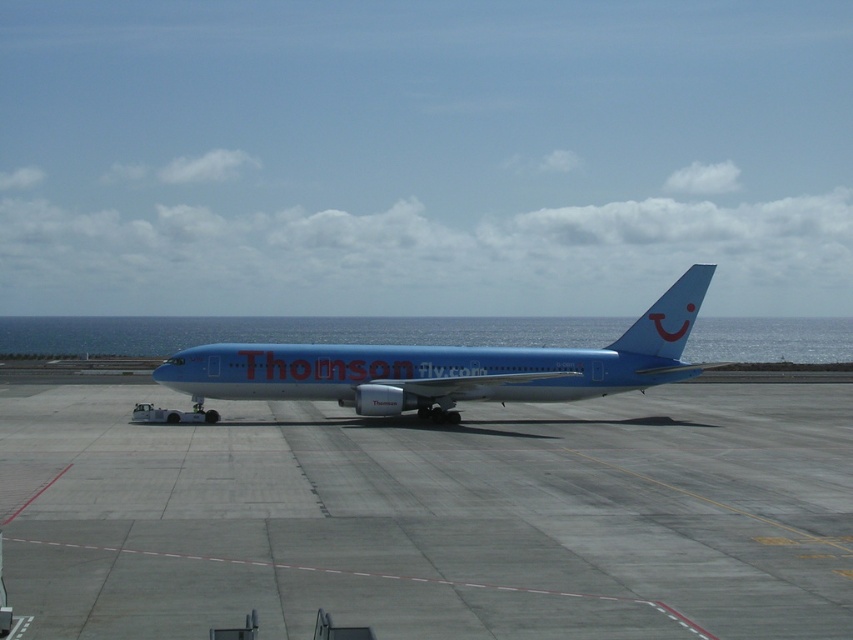
You are a ground crew member who needs to inspect the blue glossy airplane at center. Since the smooth concrete tarmac at center is under it, can you walk underneath the airplane to check the landing gear?

The smooth concrete tarmac at center is positioned under the blue glossy airplane at center, so yes, you can walk underneath the blue glossy airplane at center to check the landing gear since the tarmac provides a solid surface beneath it.

You are standing at the point labeled point (331, 356). You want to walk towards the point labeled point (689, 596). Which direction should you face to walk directly towards it?

You should face forward because point (689, 596) is in front of point (331, 356).

Consider the image. You are a ground crew member who needs to ensure the blue glossy airplane at center can fit within the allocated space on the smooth concrete tarmac at center. Based on the scene, can you confirm if the airplane will fit without overhanging the edges?

The smooth concrete tarmac at center has a width larger than the blue glossy airplane at center, so the airplane will fit within the allocated space without overhanging the edges.